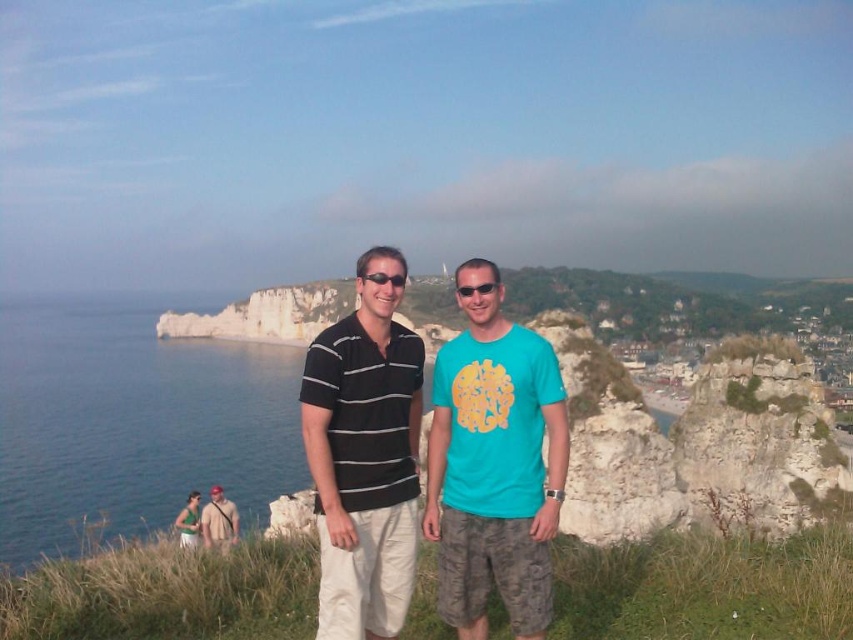
You are a photographer trying to capture a clear shot of both the black striped polo shirt at center and the black plastic sunglasses at center. Since you want both items to be visible in the frame, which one should you focus on first to ensure the other remains in focus?

The black striped polo shirt at center is taller than the black plastic sunglasses at center. To ensure both are in focus, you should focus on the black striped polo shirt at center first because it is larger and more prominent in the scene.